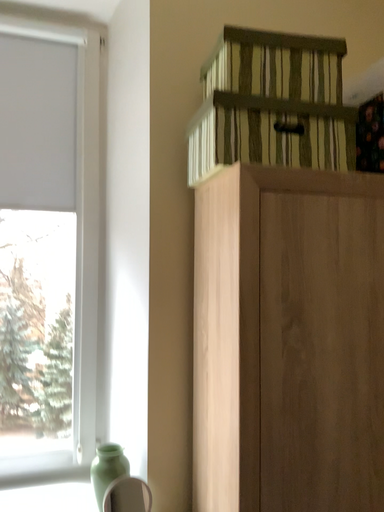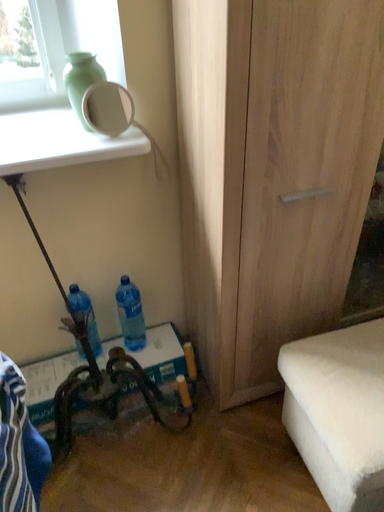
Question: How did the camera likely rotate when shooting the video?

Choices:
 (A) rotated upward
 (B) rotated downward

Answer: (B)